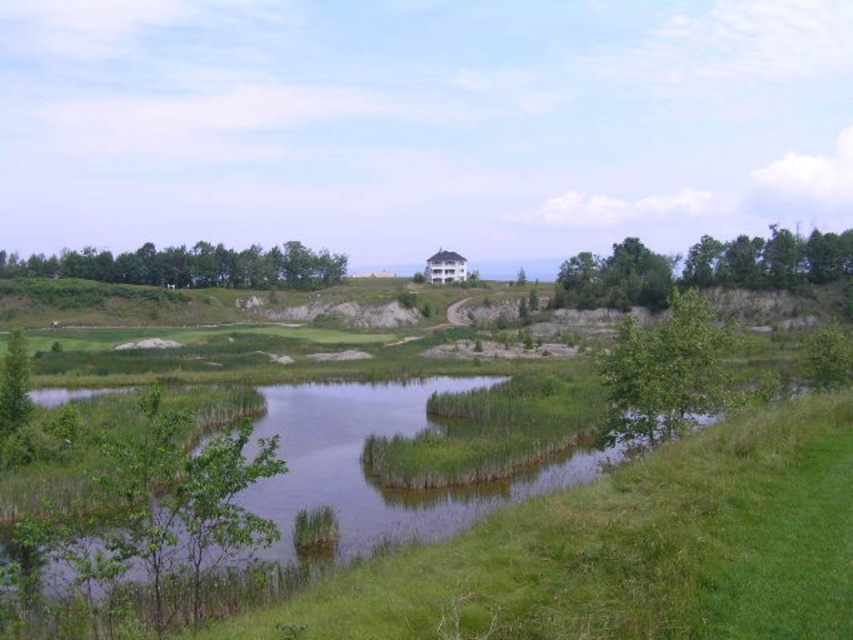
Question: Which object is positioned farthest from the green leafy tree at lower right?

Choices:
 (A) green leafy trees at upper left
 (B) green leafy trees at right

Answer: (A)

Question: Which object appears farthest from the camera in this image?

Choices:
 (A) green leafy trees at upper left
 (B) green leafy trees at right
 (C) green leafy tree at lower right

Answer: (A)

Question: Does green leafy trees at right have a lesser width compared to green leafy trees at upper left?

Choices:
 (A) yes
 (B) no

Answer: (A)

Question: Which of these objects is positioned farthest from the green leafy tree at lower right?

Choices:
 (A) green leafy trees at right
 (B) green leafy trees at upper left

Answer: (B)

Question: In this image, where is green leafy tree at lower right located relative to green leafy trees at upper left?

Choices:
 (A) left
 (B) right

Answer: (B)

Question: Can you confirm if green leafy tree at lower right is positioned to the right of green leafy trees at upper left?

Choices:
 (A) yes
 (B) no

Answer: (A)